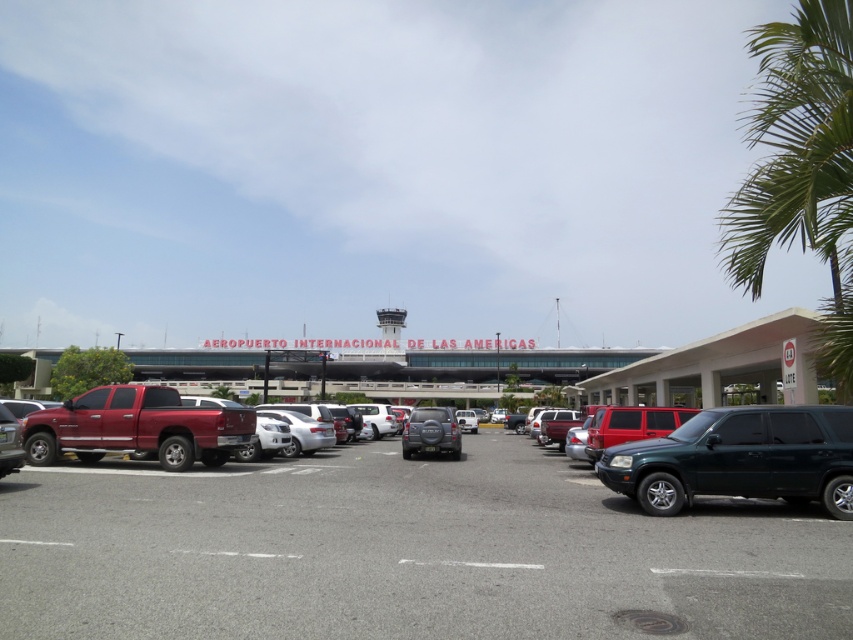
Question: Which of the following is the closest to the observer?

Choices:
 (A) matte red truck at left
 (B) shiny black suv at right

Answer: (B)

Question: Which of the following is the closest to the observer?

Choices:
 (A) satin silver suv at center
 (B) shiny black suv at right

Answer: (B)

Question: Is gray asphalt parking lot at center bigger than satin silver suv at center?

Choices:
 (A) no
 (B) yes

Answer: (B)

Question: Does satin silver suv at center appear under matte red truck at left?

Choices:
 (A) yes
 (B) no

Answer: (A)

Question: Which point is farther to the camera?

Choices:
 (A) matte red truck at left
 (B) green leafy palm tree at right
 (C) shiny black suv at right

Answer: (A)

Question: Is shiny black suv at right in front of satin silver suv at center?

Choices:
 (A) yes
 (B) no

Answer: (A)